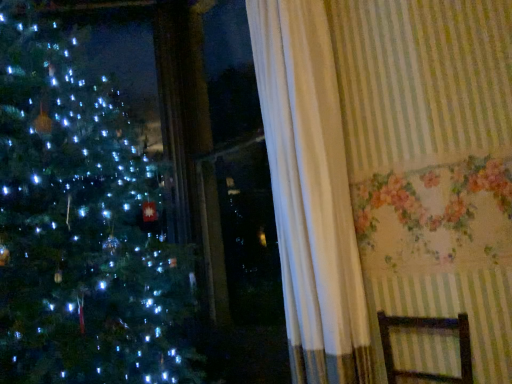
Question: Should I look upward or downward to see brown wooden armchair at lower right?

Choices:
 (A) up
 (B) down

Answer: (B)